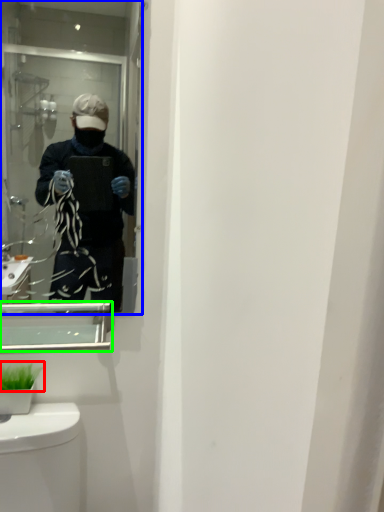
Question: Which object is the closest to the plant (highlighted by a red box)? Choose among these: mirror (highlighted by a blue box) or medicine cabinet (highlighted by a green box).

Choices:
 (A) mirror
 (B) medicine cabinet

Answer: (B)